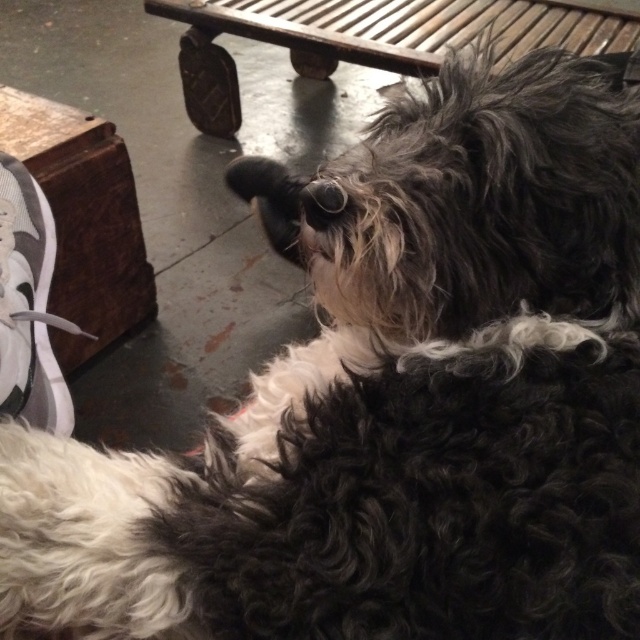
Who is higher up, wooden bench at upper center or white fabric shoe at lower left?

wooden bench at upper center is higher up.

Measure the distance between wooden bench at upper center and camera.

wooden bench at upper center is 1.88 meters away from camera.

Where is `wooden bench at upper center`? Image resolution: width=640 pixels, height=640 pixels. wooden bench at upper center is located at coordinates (371, 38).

Is wooden bench at upper center taller than wooden park bench at left?

In fact, wooden bench at upper center may be shorter than wooden park bench at left.

Who is taller, wooden bench at upper center or wooden park bench at left?

Standing taller between the two is wooden park bench at left.

Who is more distant from viewer, [193,42] or [38,164]?

Positioned behind is point [193,42].

Identify the location of wooden bench at upper center. (371, 38).

Is wooden park bench at left to the right of white fabric shoe at lower left from the viewer's perspective?

In fact, wooden park bench at left is to the left of white fabric shoe at lower left.

Can you confirm if wooden park bench at left is positioned to the left of white fabric shoe at lower left?

Correct, you'll find wooden park bench at left to the left of white fabric shoe at lower left.

Which is in front, point (61, 308) or point (49, 364)?

Point (49, 364) is more forward.

Find the location of `wooden park bench at left`. wooden park bench at left is located at coordinates [83, 220].